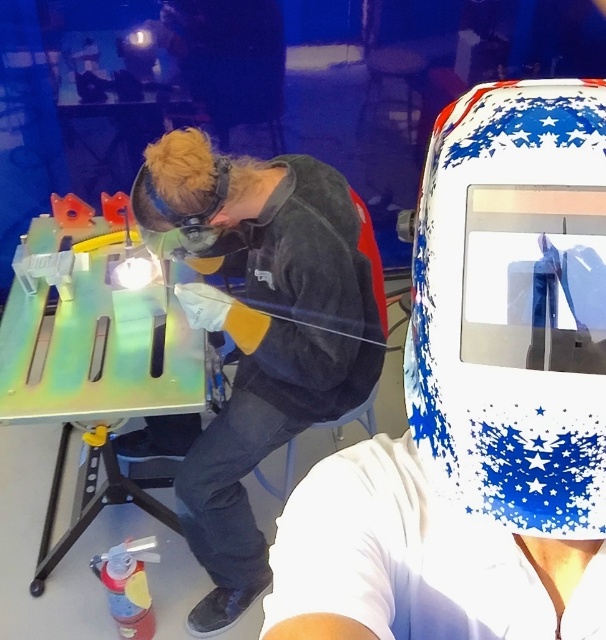
Based on the photo, can you confirm if matte black welding helmet at center is positioned to the right of matte black goggles at center?

Correct, you'll find matte black welding helmet at center to the right of matte black goggles at center.

Is point (327, 369) positioned before point (168, 216)?

No, it is behind (168, 216).

Between point (190, 189) and point (199, 250), which one is positioned behind?

The point (199, 250) is more distant.

Where is `matte black welding helmet at center`? This screenshot has width=606, height=640. matte black welding helmet at center is located at coordinates (258, 336).

Is point (604, 536) more distant than point (145, 349)?

No, it is not.

Which is in front, point (464, 134) or point (81, 474)?

Positioned in front is point (464, 134).

Is point (411, 493) positioned in front of point (218, 371)?

Yes, point (411, 493) is closer to viewer.

Where is `white matte welding helmet at upper right`? white matte welding helmet at upper right is located at coordinates (478, 401).

Does point (161, 294) lie in front of point (219, 157)?

No, (161, 294) is behind (219, 157).

Can you confirm if metallic/reflective welding table at left is positioned to the left of matte black goggles at center?

Yes, metallic/reflective welding table at left is to the left of matte black goggles at center.

The image size is (606, 640). What do you see at coordinates (96, 369) in the screenshot? I see `metallic/reflective welding table at left` at bounding box center [96, 369].

Locate an element on the screen. The image size is (606, 640). metallic/reflective welding table at left is located at coordinates (96, 369).